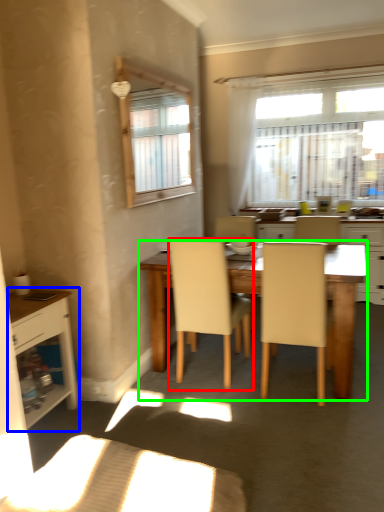
Question: Which object is the farthest from chair (highlighted by a red box)? Choose among these: cabinetry (highlighted by a blue box) or desk (highlighted by a green box).

Choices:
 (A) cabinetry
 (B) desk

Answer: (A)